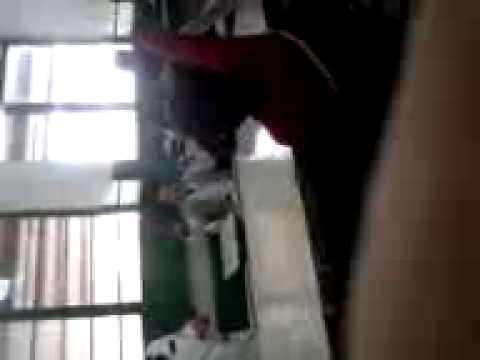
Where is `white curtain`? The image size is (480, 360). white curtain is located at coordinates (65, 174), (54, 20).